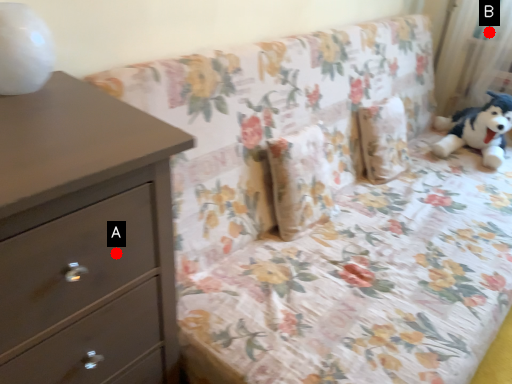
Question: Two points are circled on the image, labeled by A and B beside each circle. Which point is farther from the camera taking this photo?

Choices:
 (A) A is further
 (B) B is further

Answer: (B)